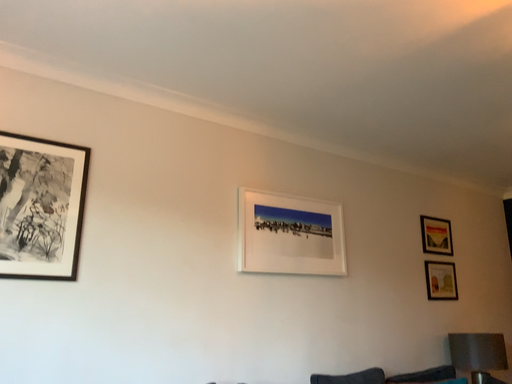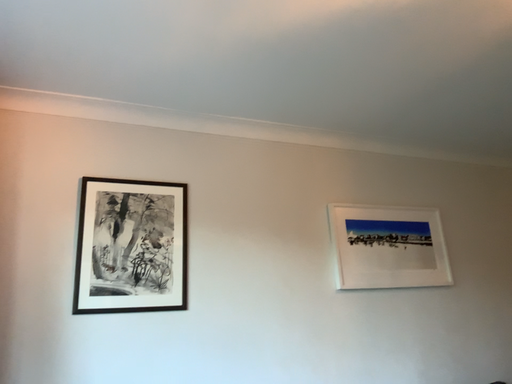
Question: Which way did the camera rotate in the video?

Choices:
 (A) rotated right
 (B) rotated left

Answer: (B)